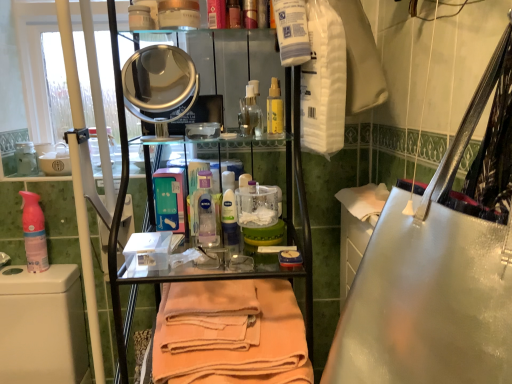
Where is `vacant space to the right of pink matte spray can at left, which is the 2th cleaning product from front to back`? The width and height of the screenshot is (512, 384). vacant space to the right of pink matte spray can at left, which is the 2th cleaning product from front to back is located at coordinates (61, 268).